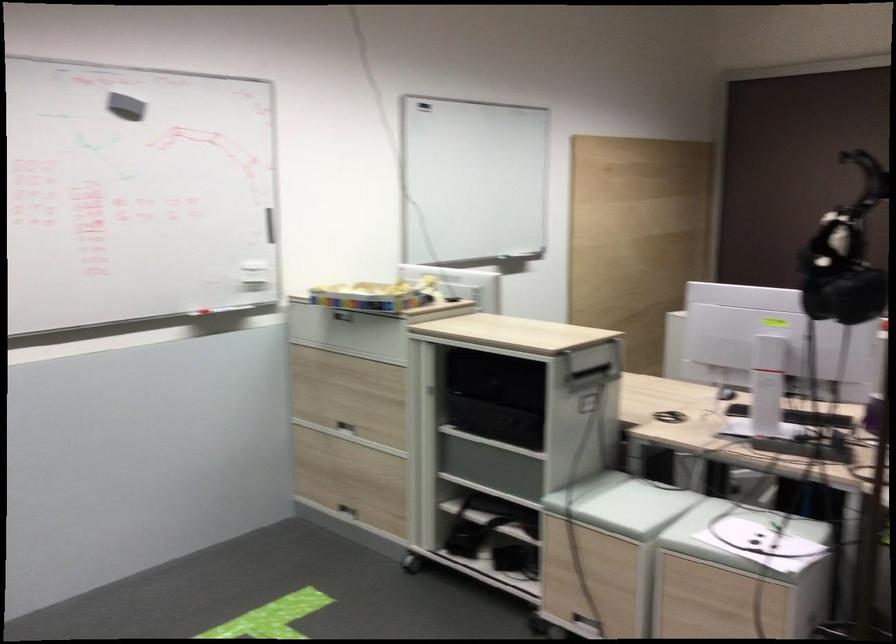
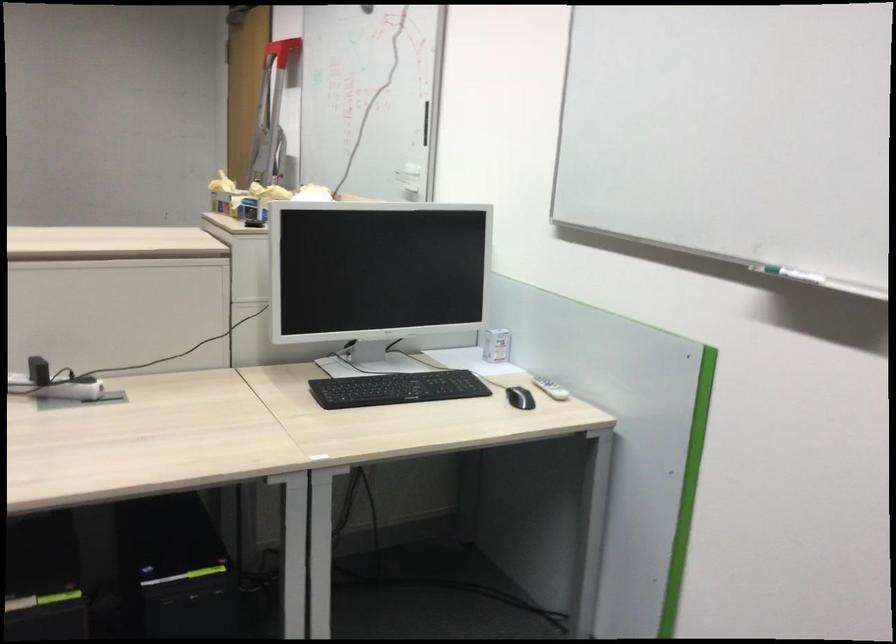
The point at (248, 238) is marked in the first image. Where is the corresponding point in the second image?

(426, 122)